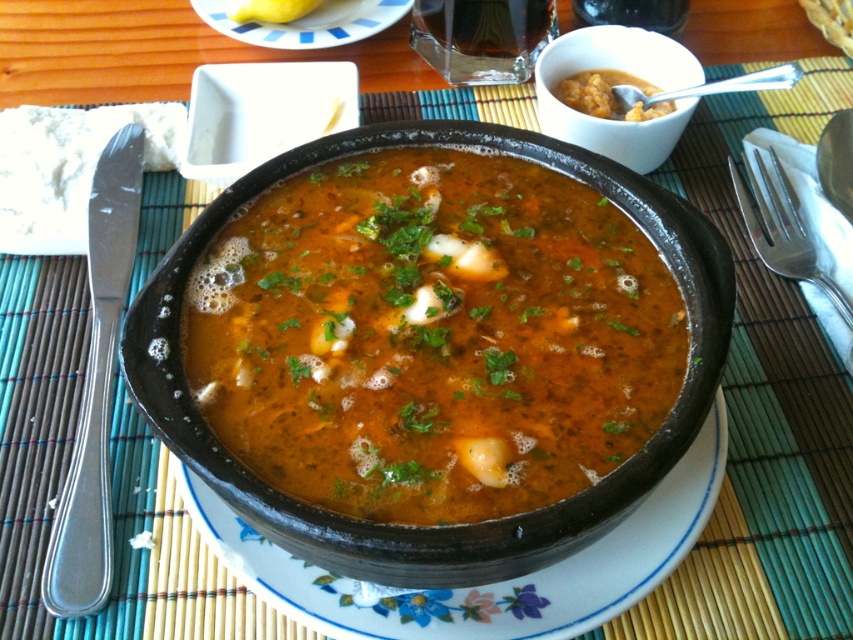
Is satin silver knife at left positioned behind silver spoon at upper right?

That is False.

Locate an element on the screen. This screenshot has height=640, width=853. satin silver knife at left is located at coordinates (96, 388).

From the picture: Is brown matte soup at upper center thinner than silver spoon at upper right?

Indeed, brown matte soup at upper center has a lesser width compared to silver spoon at upper right.

Does brown matte soup at upper center appear on the right side of silver spoon at upper right?

In fact, brown matte soup at upper center is to the left of silver spoon at upper right.

You are a GUI agent. You are given a task and a screenshot of the screen. Output one action in this format:
    pyautogui.click(x=<x>, y=<y>)
    Task: Click on the brown matte soup at upper center
    The image size is (853, 640).
    Given the screenshot: What is the action you would take?
    pyautogui.click(x=605, y=93)

Is white matte bowl at upper right below white ceramic plate at upper center?

Indeed, white matte bowl at upper right is positioned under white ceramic plate at upper center.

Describe the element at coordinates (619, 68) in the screenshot. I see `white matte bowl at upper right` at that location.

Is point (679, 45) farther from camera compared to point (293, 40)?

No, (679, 45) is closer to viewer.

Find the location of a particular element. The height and width of the screenshot is (640, 853). white matte bowl at upper right is located at coordinates (619, 68).